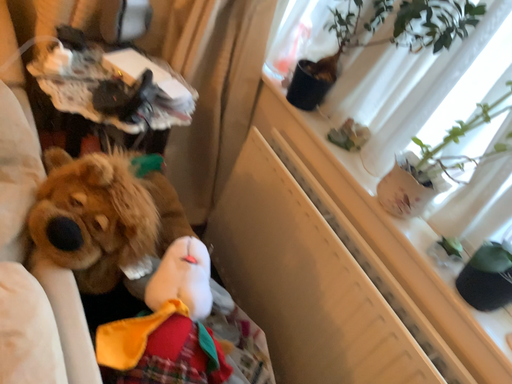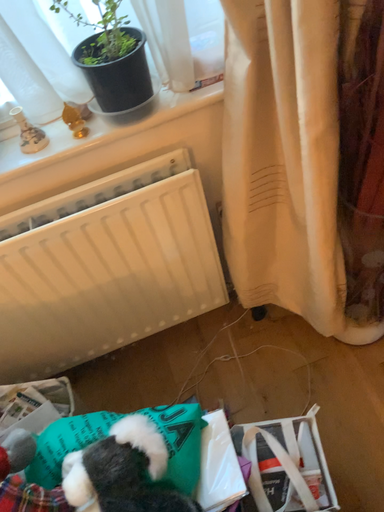
Question: Which way did the camera rotate in the video?

Choices:
 (A) rotated upward
 (B) rotated downward

Answer: (A)